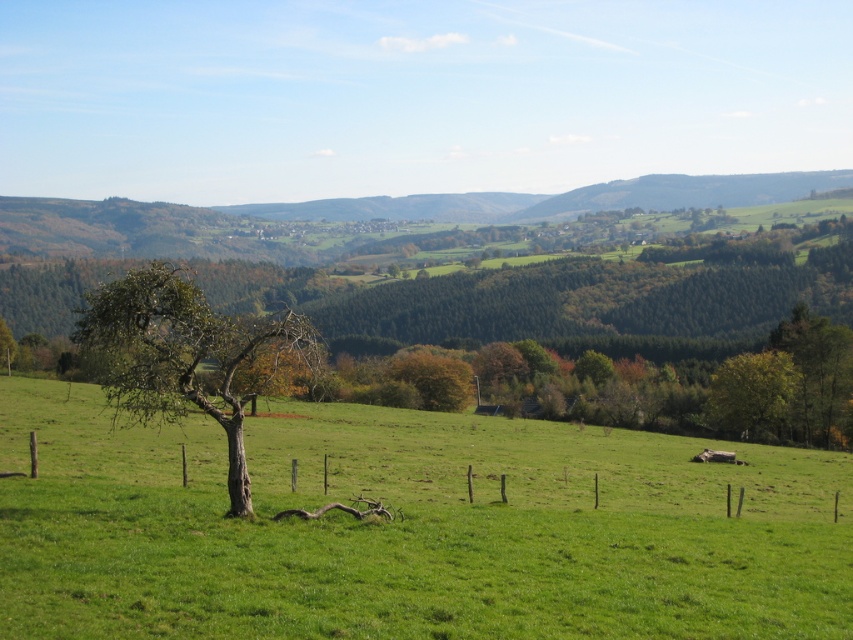
Question: Is bare wood tree at left smaller than green leafy tree at right?

Choices:
 (A) yes
 (B) no

Answer: (B)

Question: Is green grassy field at center thinner than green leafy tree at right?

Choices:
 (A) yes
 (B) no

Answer: (B)

Question: Which point is closer to the camera?

Choices:
 (A) (767, 397)
 (B) (126, 291)
 (C) (198, 500)

Answer: (B)

Question: Which object appears closest to the camera in this image?

Choices:
 (A) green grassy field at center
 (B) green leafy tree at right
 (C) bare wood tree at left

Answer: (A)

Question: Which object is farther from the camera taking this photo?

Choices:
 (A) green grassy field at center
 (B) bare wood tree at left

Answer: (B)

Question: In this image, where is bare wood tree at left located relative to green leafy tree at right?

Choices:
 (A) right
 (B) left

Answer: (B)